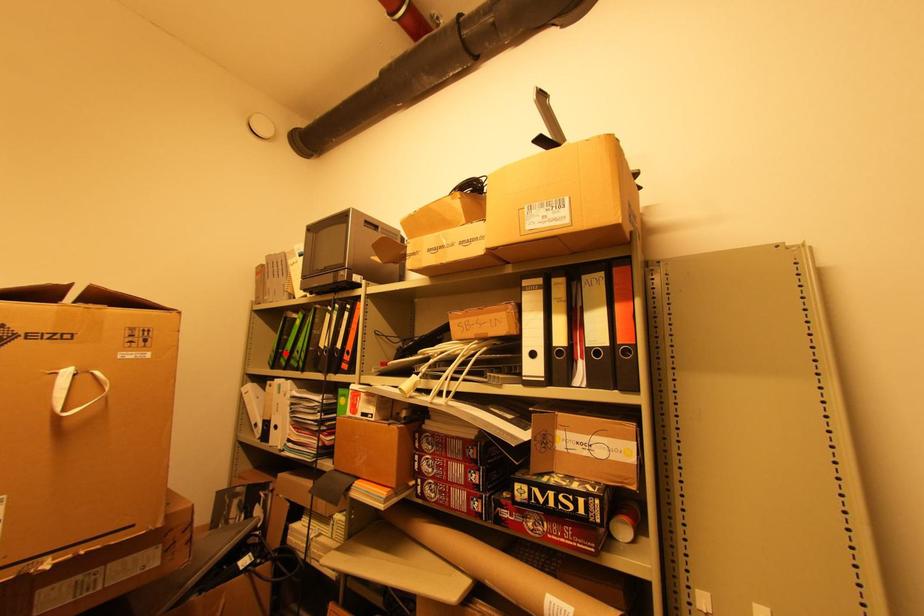
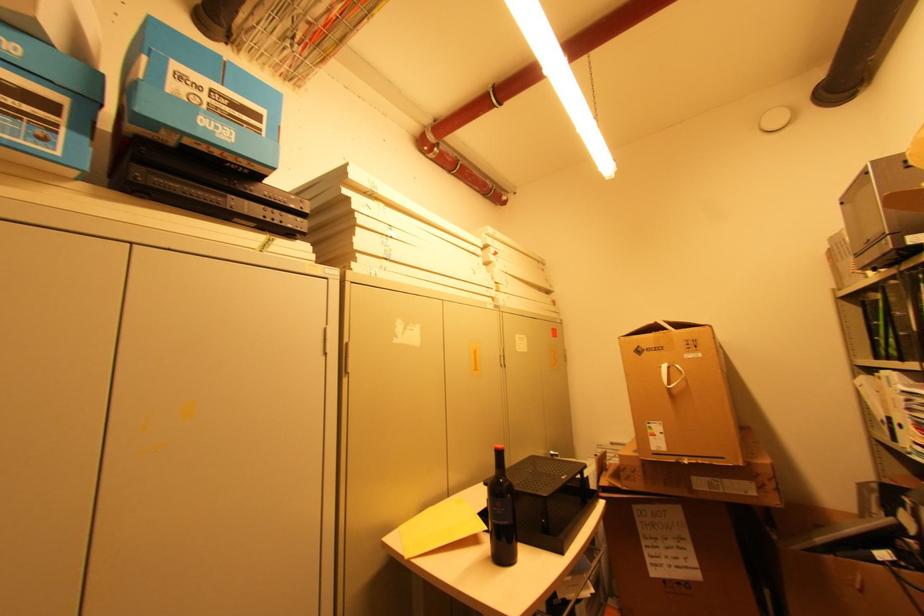
The point at the highlighted location is marked in the first image. Where is the corresponding point in the second image?

(881, 341)